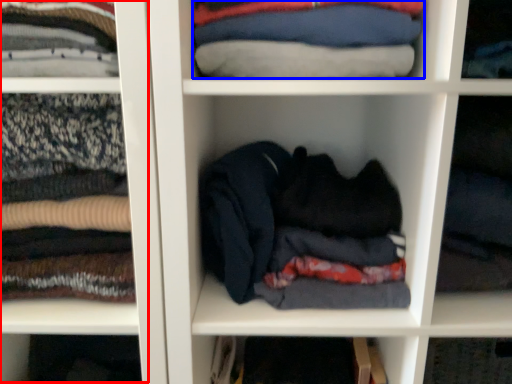
Question: Which object is closer to the camera taking this photo, cabinet (highlighted by a red box) or clothing (highlighted by a blue box)?

Choices:
 (A) cabinet
 (B) clothing

Answer: (A)